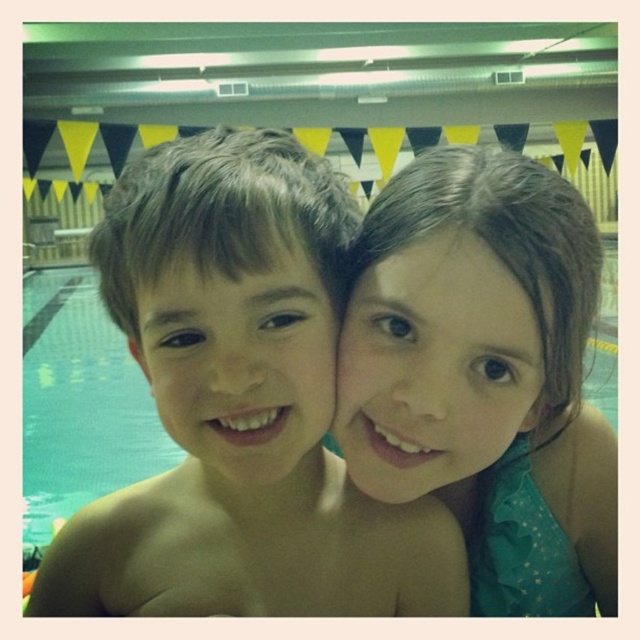
Question: Does shiny skin boy at center appear on the right side of smooth skin face at center?

Choices:
 (A) no
 (B) yes

Answer: (B)

Question: Among these points, which one is farthest from the camera?

Choices:
 (A) (186, 269)
 (B) (208, 184)

Answer: (A)

Question: Which point is closer to the camera taking this photo?

Choices:
 (A) (378, 234)
 (B) (509, 292)
 (C) (433, 508)
 (D) (296, 448)

Answer: (D)

Question: Among these points, which one is nearest to the camera?

Choices:
 (A) (285, 253)
 (B) (170, 419)
 (C) (339, 356)
 (D) (525, 164)

Answer: (A)

Question: Is shiny skin boy at center in front of smooth teal dress at center?

Choices:
 (A) yes
 (B) no

Answer: (A)

Question: Does shiny skin boy at center have a greater width compared to smooth skin face at center?

Choices:
 (A) yes
 (B) no

Answer: (A)